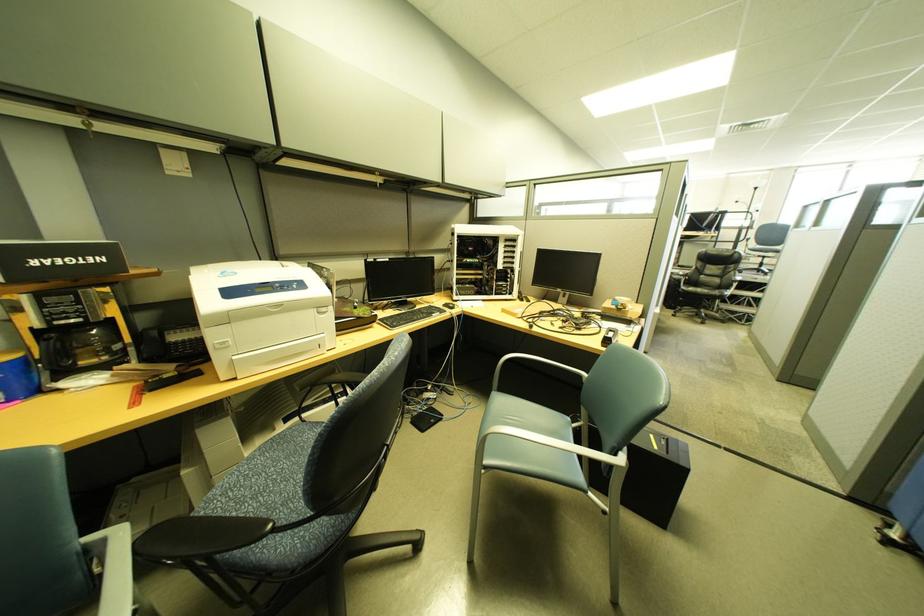
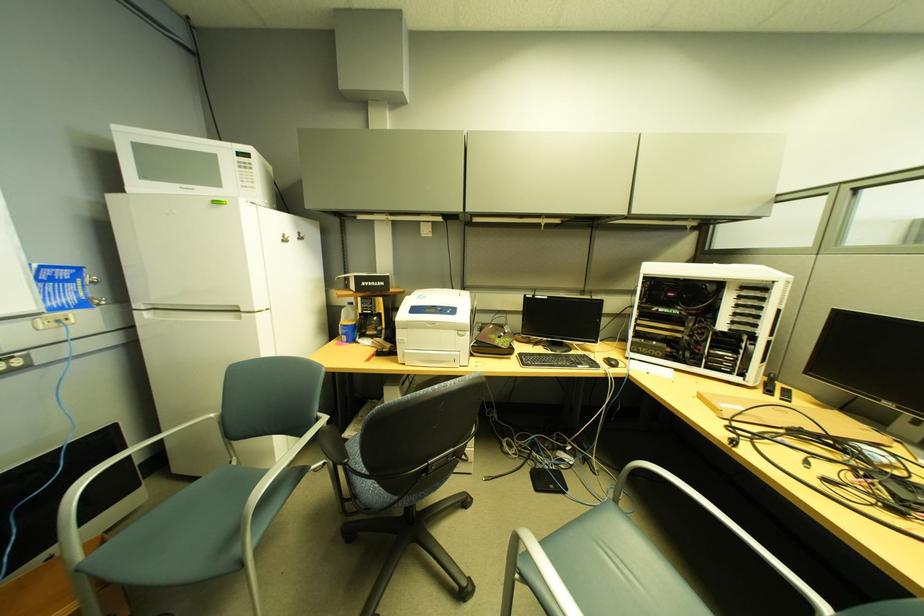
Find the pixel in the second image that matches [444,315] in the first image.

(592, 367)